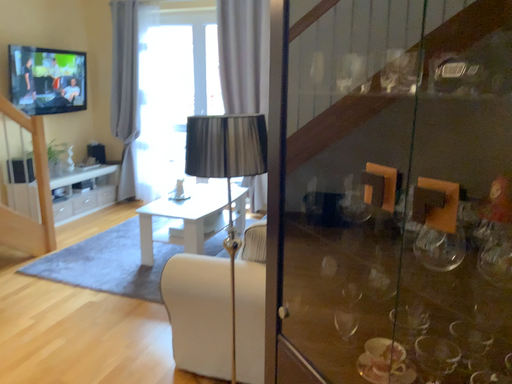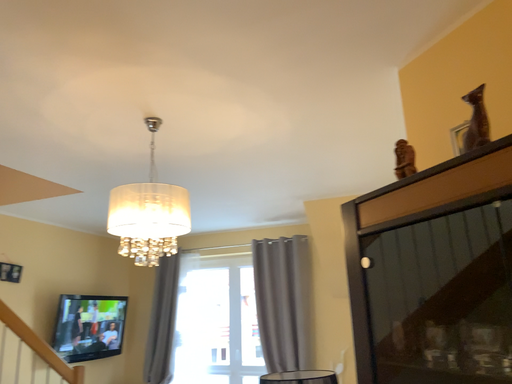
Question: How did the camera likely rotate when shooting the video?

Choices:
 (A) rotated upward
 (B) rotated downward

Answer: (A)